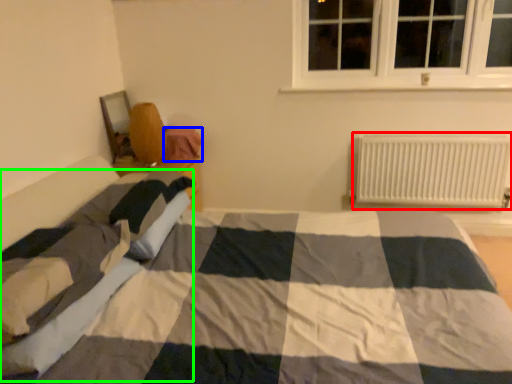
Question: Which is farther away from radiator (highlighted by a red box)? material (highlighted by a blue box) or blanket (highlighted by a green box)?

Choices:
 (A) material
 (B) blanket

Answer: (B)